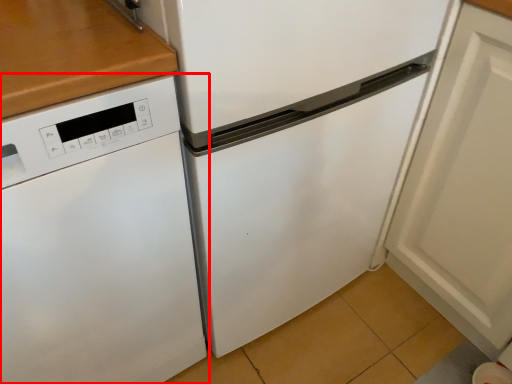
Question: From the image, what is the correct spatial relationship of home appliance (annotated by the red box) in relation to door?

Choices:
 (A) left
 (B) right

Answer: (A)